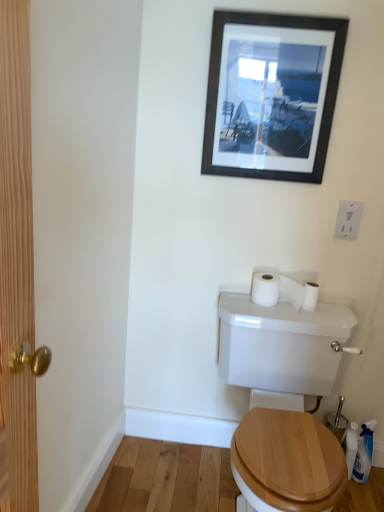
Identify the location of vacant space to the right of white matte toilet paper at upper right, positioned as the first toilet paper in right-to-left order. This screenshot has height=512, width=384. (330, 313).